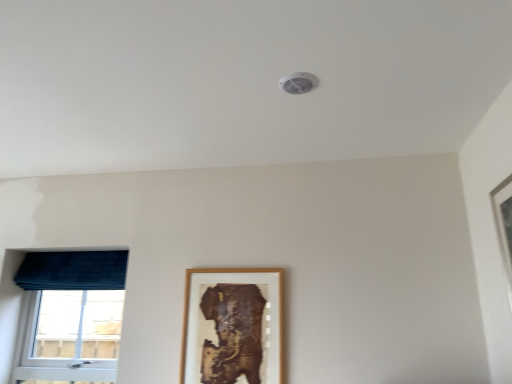
Question: Can velvet blue curtain at left be found inside velvet blue window at left?

Choices:
 (A) yes
 (B) no

Answer: (B)

Question: Is velvet blue window at left directly adjacent to velvet blue curtain at left?

Choices:
 (A) no
 (B) yes

Answer: (A)

Question: From a real-world perspective, is velvet blue window at left below velvet blue curtain at left?

Choices:
 (A) no
 (B) yes

Answer: (B)

Question: Does velvet blue window at left lie in front of velvet blue curtain at left?

Choices:
 (A) no
 (B) yes

Answer: (B)

Question: Is velvet blue window at left oriented towards velvet blue curtain at left?

Choices:
 (A) no
 (B) yes

Answer: (B)

Question: From a real-world perspective, relative to wooden picture frame at center, is velvet blue curtain at left vertically above or below?

Choices:
 (A) above
 (B) below

Answer: (A)

Question: Based on their sizes in the image, would you say velvet blue curtain at left is bigger or smaller than wooden picture frame at center?

Choices:
 (A) big
 (B) small

Answer: (A)

Question: Looking at their shapes, would you say velvet blue curtain at left is wider or thinner than wooden picture frame at center?

Choices:
 (A) wide
 (B) thin

Answer: (A)

Question: Considering the relative positions of velvet blue curtain at left and wooden picture frame at center in the image provided, is velvet blue curtain at left to the left or to the right of wooden picture frame at center?

Choices:
 (A) right
 (B) left

Answer: (B)

Question: From the image's perspective, is velvet blue curtain at left above or below velvet blue window at left?

Choices:
 (A) above
 (B) below

Answer: (A)

Question: Is point (91, 286) positioned closer to the camera than point (112, 249)?

Choices:
 (A) farther
 (B) closer

Answer: (A)

Question: In terms of width, does velvet blue curtain at left look wider or thinner when compared to velvet blue window at left?

Choices:
 (A) thin
 (B) wide

Answer: (B)

Question: From a real-world perspective, is velvet blue curtain at left positioned above or below velvet blue window at left?

Choices:
 (A) above
 (B) below

Answer: (A)

Question: In the image, is wooden picture frame at center positioned in front of or behind velvet blue window at left?

Choices:
 (A) front
 (B) behind

Answer: (A)

Question: Is point (234, 269) closer or farther from the camera than point (45, 296)?

Choices:
 (A) closer
 (B) farther

Answer: (A)